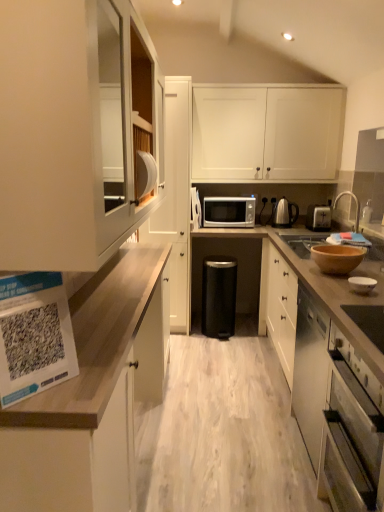
What do you see at coordinates (195, 209) in the screenshot? I see `white matte microwave at center, positioned as the first appliance in left-to-right order` at bounding box center [195, 209].

What do you see at coordinates (283, 212) in the screenshot? I see `polished stainless steel kettle at center-right, which appears as the second appliance when viewed from the left` at bounding box center [283, 212].

Find the location of a particular element. Image resolution: width=384 pixels, height=512 pixels. polished stainless steel kettle at center-right, the first appliance when ordered from right to left is located at coordinates (283, 212).

What do you see at coordinates (266, 132) in the screenshot? I see `white matte cabinet at upper center, the fourth cabinetry in the left-to-right sequence` at bounding box center [266, 132].

Identify the location of white matte microwave at center, positioned as the first appliance in left-to-right order. (195, 209).

Does point (99, 380) appear closer or farther from the camera than point (365, 249)?

Point (99, 380) is closer to the camera than point (365, 249).

Can you tell me how much wooden countertop at left, positioned as the second cabinetry in left-to-right order, and wooden bowl at right, the 1th bowl in the back-to-front sequence, differ in facing direction?

wooden countertop at left, positioned as the second cabinetry in left-to-right order, and wooden bowl at right, the 1th bowl in the back-to-front sequence, are facing 179 degrees away from each other.

Consider the image. Between wooden countertop at left, positioned as the second cabinetry in left-to-right order, and wooden bowl at right, which is counted as the 2th bowl, starting from the front, which one appears on the right side from the viewer's perspective?

From the viewer's perspective, wooden bowl at right, which is counted as the 2th bowl, starting from the front, appears more on the right side.

Considering the sizes of objects white matte microwave at center, which is the 2th appliance from right to left, and polished stainless steel kettle at center-right, which appears as the second appliance when viewed from the left, in the image provided, who is thinner, white matte microwave at center, which is the 2th appliance from right to left, or polished stainless steel kettle at center-right, which appears as the second appliance when viewed from the left,?

With smaller width is polished stainless steel kettle at center-right, which appears as the second appliance when viewed from the left.

Which is closer, (x=198, y=193) or (x=278, y=224)?

Clearly, point (x=198, y=193) is closer to the camera than point (x=278, y=224).

Where is `appliance located in front of the polished stainless steel kettle at center-right, which appears as the second appliance when viewed from the left`? appliance located in front of the polished stainless steel kettle at center-right, which appears as the second appliance when viewed from the left is located at coordinates (195, 209).

Considering the sizes of objects white matte microwave at center, positioned as the first appliance in left-to-right order, and polished stainless steel kettle at center-right, which appears as the second appliance when viewed from the left, in the image provided, who is taller, white matte microwave at center, positioned as the first appliance in left-to-right order, or polished stainless steel kettle at center-right, which appears as the second appliance when viewed from the left,?

white matte microwave at center, positioned as the first appliance in left-to-right order, is taller.

From the image's perspective, which one is positioned lower, wooden at right or white matte cabinet at upper center, the fourth cabinetry in the left-to-right sequence?

wooden at right.

In the scene shown: Is white matte cabinet at upper center, the fourth cabinetry in the left-to-right sequence, located within wooden at right?

That's incorrect, white matte cabinet at upper center, the fourth cabinetry in the left-to-right sequence, is not inside wooden at right.

Between point (248, 265) and point (283, 172), which one is positioned behind?

Point (248, 265)

How different are the orientations of wooden at right and white matte cabinet at upper center, which ranks as the 1th cabinetry in right-to-left order, in degrees?

They differ by 91.3 degrees in their facing directions.

Would you say silver metallic faucet at upper right is outside brown matte bowl at right?

silver metallic faucet at upper right is positioned outside brown matte bowl at right.

Is point (344, 194) less distant than point (282, 238)?

No, (344, 194) is further to viewer.

From a real-world perspective, who is located lower, silver metallic faucet at upper right or brown matte bowl at right?

In real-world perspective, brown matte bowl at right is lower.

Is the position of silver metallic faucet at upper right less distant than that of brown matte bowl at right?

No, silver metallic faucet at upper right is further to the viewer.

From the image's perspective, is white glossy bowl at lower right, acting as the first bowl starting from the bottom, above or below polished stainless steel kettle at center-right, the first appliance when ordered from right to left?

Clearly, from the image's perspective, white glossy bowl at lower right, acting as the first bowl starting from the bottom, is below polished stainless steel kettle at center-right, the first appliance when ordered from right to left.

Considering the relative sizes of white glossy bowl at lower right, acting as the 2th bowl starting from the top, and polished stainless steel kettle at center-right, the first appliance when ordered from right to left, in the image provided, is white glossy bowl at lower right, acting as the 2th bowl starting from the top, wider than polished stainless steel kettle at center-right, the first appliance when ordered from right to left,?

In fact, white glossy bowl at lower right, acting as the 2th bowl starting from the top, might be narrower than polished stainless steel kettle at center-right, the first appliance when ordered from right to left.

Is polished stainless steel kettle at center-right, which appears as the second appliance when viewed from the left, at the back of white glossy bowl at lower right, acting as the 2th bowl starting from the top?

No, white glossy bowl at lower right, acting as the 2th bowl starting from the top,'s orientation is not away from polished stainless steel kettle at center-right, which appears as the second appliance when viewed from the left.

Is white glossy bowl at lower right, which is the first bowl from front to back, closer to the viewer compared to polished stainless steel kettle at center-right, which appears as the second appliance when viewed from the left?

Yes, white glossy bowl at lower right, which is the first bowl from front to back, is closer to the viewer.

Consider the image. From the image's perspective, is wooden bowl at right, which is counted as the 2th bowl, starting from the front, located above silver metallic toaster at right?

Actually, wooden bowl at right, which is counted as the 2th bowl, starting from the front, appears below silver metallic toaster at right in the image.

How distant is wooden bowl at right, the 2th bowl ordered from the bottom, from silver metallic toaster at right?

The distance of wooden bowl at right, the 2th bowl ordered from the bottom, from silver metallic toaster at right is 4.22 feet.

Is wooden bowl at right, placed as the 1th bowl when sorted from top to bottom, far from silver metallic toaster at right?

Indeed, wooden bowl at right, placed as the 1th bowl when sorted from top to bottom, is not near silver metallic toaster at right.

Who is shorter, wooden bowl at right, the 2th bowl ordered from the bottom, or silver metallic toaster at right?

Standing shorter between the two is wooden bowl at right, the 2th bowl ordered from the bottom.

Would you say brown matte bowl at right is to the left or to the right of wooden at right in the picture?

brown matte bowl at right is to the right of wooden at right.

Looking at this image, is brown matte bowl at right turned away from wooden at right?

That's right, brown matte bowl at right is facing away from wooden at right.

From the image's perspective, which object appears higher, brown matte bowl at right or wooden at right?

brown matte bowl at right.

The width and height of the screenshot is (384, 512). In the image, there is a wooden bowl at right, which is counted as the 2th bowl, starting from the front. Find the location of `cabinetry below it (from a real-world perspective)`. cabinetry below it (from a real-world perspective) is located at coordinates (86, 401).

Identify the location of appliance below the white matte microwave at center, which is the 2th appliance from right to left (from the image's perspective). (283, 212).

Considering their positions, is white matte cabinet at upper center, which ranks as the 1th cabinetry in right-to-left order, positioned further to white matte cabinet at upper left, which ranks as the 3th cabinetry in left-to-right order, than polished stainless steel kettle at center-right, the first appliance when ordered from right to left?

Among the two, polished stainless steel kettle at center-right, the first appliance when ordered from right to left, is located further to white matte cabinet at upper left, which ranks as the 3th cabinetry in left-to-right order.

Based on their spatial positions, is silver metallic toaster at right or white glossy bowl at lower right, acting as the 2th bowl starting from the top, further from wooden countertop at left, positioned as the 3th cabinetry in right-to-left order?

silver metallic toaster at right is further to wooden countertop at left, positioned as the 3th cabinetry in right-to-left order.

Based on their spatial positions, is polished stainless steel kettle at center-right, the first appliance when ordered from right to left, or white matte cabinet at upper center, which ranks as the 1th cabinetry in right-to-left order, closer to black matte trash can at center?

Among the two, polished stainless steel kettle at center-right, the first appliance when ordered from right to left, is located nearer to black matte trash can at center.

When comparing their distances from silver metallic toaster at right, does wooden bowl at right, the 1th bowl in the back-to-front sequence, or silver metallic faucet at upper right seem further?

wooden bowl at right, the 1th bowl in the back-to-front sequence, is further to silver metallic toaster at right.

Which object lies further to the anchor point black matte trash can at center, white matte microwave at center, which is the 2th appliance from right to left, or white matte cabinet at upper center, the fourth cabinetry in the left-to-right sequence?

white matte cabinet at upper center, the fourth cabinetry in the left-to-right sequence, is positioned further to the anchor black matte trash can at center.

Based on the photo, which object lies further to the anchor point silver metallic faucet at upper right, white matte microwave at center, positioned as the first appliance in left-to-right order, or black matte trash can at center?

Based on the image, black matte trash can at center appears to be further to silver metallic faucet at upper right.

When comparing their distances from silver metallic faucet at upper right, does brown matte bowl at right or white matte microwave at center, which is the 2th appliance from right to left, seem closer?

brown matte bowl at right is closer to silver metallic faucet at upper right.

Based on their spatial positions, is white matte microwave at center, positioned as the first appliance in left-to-right order, or silver metallic toaster at right closer to white matte cabinet at upper center, which ranks as the 1th cabinetry in right-to-left order?

silver metallic toaster at right.

Where is `appliance between white matte cabinet at upper left, which is counted as the fourth cabinetry, starting from the right, and polished stainless steel kettle at center-right, the first appliance when ordered from right to left, along the z-axis`? appliance between white matte cabinet at upper left, which is counted as the fourth cabinetry, starting from the right, and polished stainless steel kettle at center-right, the first appliance when ordered from right to left, along the z-axis is located at coordinates (195, 209).

This screenshot has width=384, height=512. What are the coordinates of `countertop between stainless steel oven at lower right and silver metallic faucet at upper right along the z-axis` in the screenshot? It's located at (321, 287).

Where is `gas stove between white matte cabinet at upper left, placed as the 2th cabinetry when sorted from right to left, and silver metallic toaster at right`? This screenshot has width=384, height=512. gas stove between white matte cabinet at upper left, placed as the 2th cabinetry when sorted from right to left, and silver metallic toaster at right is located at coordinates (302, 243).

Locate an element on the screen. The height and width of the screenshot is (512, 384). oven located between wooden countertop at left, positioned as the 3th cabinetry in right-to-left order, and silver metallic faucet at upper right in the depth direction is located at coordinates (349, 439).